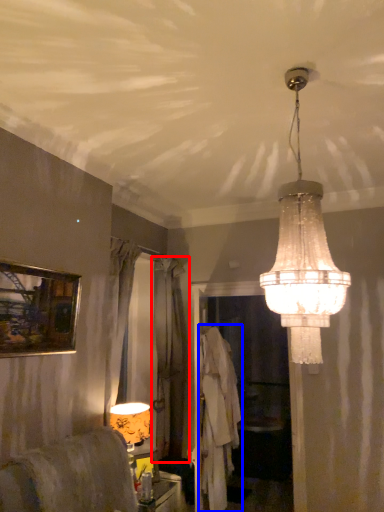
Question: Which object appears farthest to the camera in this image, curtain (highlighted by a red box) or robe (highlighted by a blue box)?

Choices:
 (A) curtain
 (B) robe

Answer: (A)